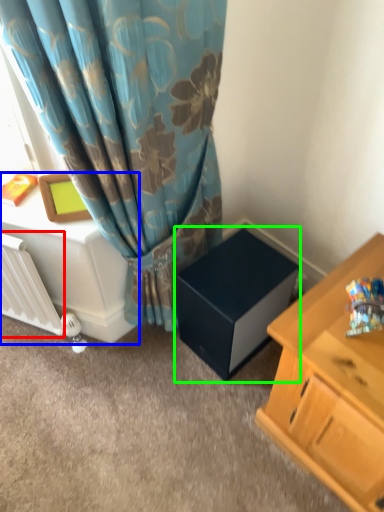
Question: Which object is the closest to the radiator (highlighted by a red box)? Choose among these: table (highlighted by a blue box) or cardboard box (highlighted by a green box).

Choices:
 (A) table
 (B) cardboard box

Answer: (A)